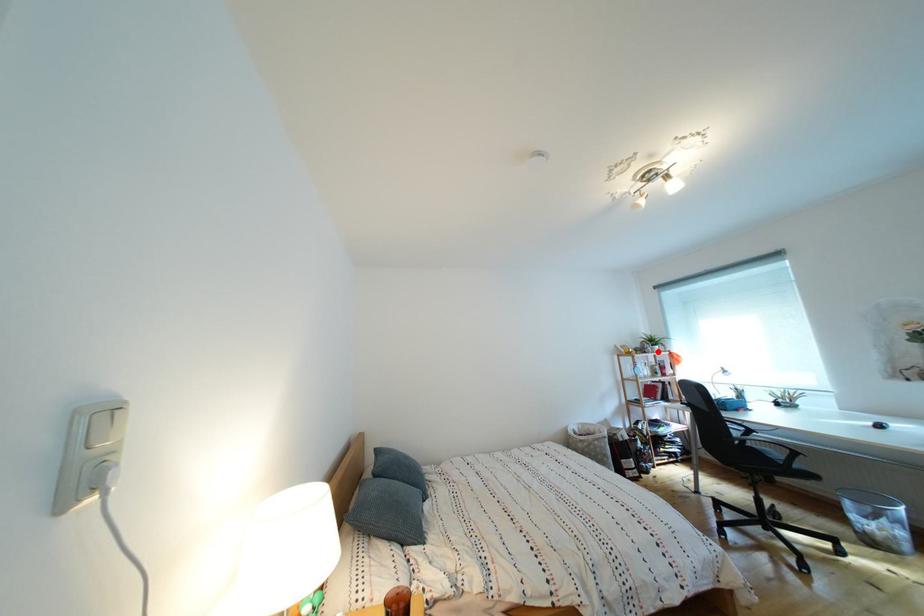
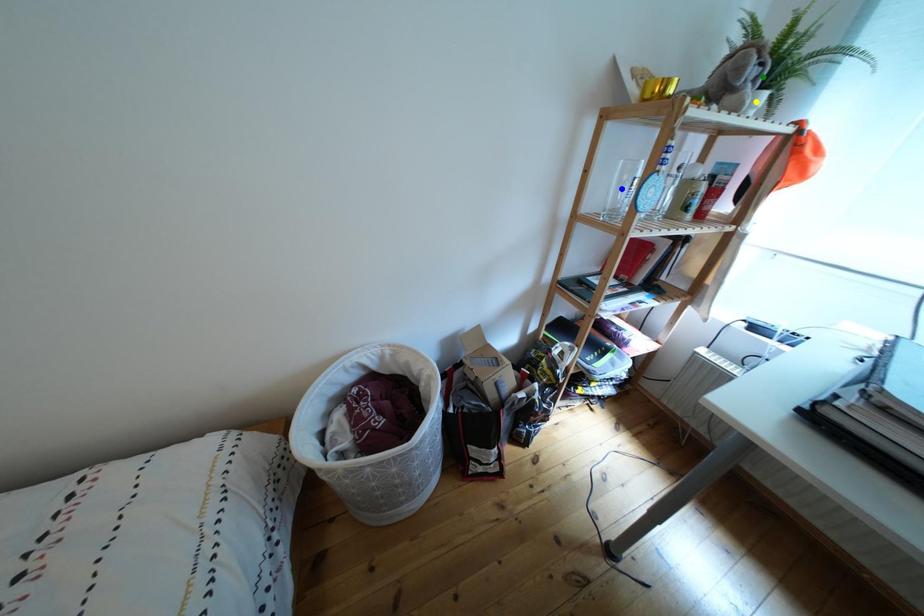
Question: I am providing you with two images of the same scene from different viewpoints. A red point is marked on the first image. You are given multiple points on the second image. In image 2, which mark is for the same physical point as the one in image 1?

Choices:
 (A) blue point
 (B) green point
 (C) yellow point

Answer: (B)